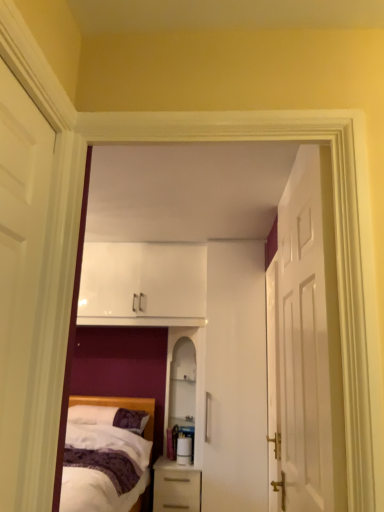
What is the approximate height of white matte door at left, positioned as the 1th door in left-to-right order?

3.34 feet.

The image size is (384, 512). What are the coordinates of `white soft bed at lower left` in the screenshot? It's located at (106, 454).

You are a GUI agent. You are given a task and a screenshot of the screen. Output one action in this format:
    pyautogui.click(x=<x>, y=<y>)
    Task: Click on the white matte door at left, which ranks as the 3th door in right-to-left order
    This screenshot has height=512, width=384.
    Given the screenshot: What is the action you would take?
    pyautogui.click(x=19, y=258)

From the picture: Considering the relative sizes of white glossy door at right, arranged as the 1th door when viewed from the right, and purple soft pillow at lower left in the image provided, is white glossy door at right, arranged as the 1th door when viewed from the right, smaller than purple soft pillow at lower left?

No, white glossy door at right, arranged as the 1th door when viewed from the right, is not smaller than purple soft pillow at lower left.

Is white glossy door at right, the 3th door when ordered from left to right, facing away from purple soft pillow at lower left?

white glossy door at right, the 3th door when ordered from left to right, does not have its back to purple soft pillow at lower left.

In the scene shown: Is white glossy door at right, the 3th door when ordered from left to right, closer to the viewer compared to purple soft pillow at lower left?

Yes, it is.

From the image's perspective, is white matte door at left, which ranks as the 3th door in right-to-left order, below white glossy door at right, arranged as the 1th door when viewed from the right?

Actually, white matte door at left, which ranks as the 3th door in right-to-left order, appears above white glossy door at right, arranged as the 1th door when viewed from the right, in the image.

Consider the image. Does white matte door at left, which ranks as the 3th door in right-to-left order, turn towards white glossy door at right, the 3th door when ordered from left to right?

No, white matte door at left, which ranks as the 3th door in right-to-left order, is not facing towards white glossy door at right, the 3th door when ordered from left to right.

In the scene shown: From a real-world perspective, between white matte door at left, which ranks as the 3th door in right-to-left order, and white glossy door at right, the 3th door when ordered from left to right, who is vertically higher?

From a 3D spatial view, white matte door at left, which ranks as the 3th door in right-to-left order, is above.

Considering the points (1, 488) and (280, 435), which point is behind, point (1, 488) or point (280, 435)?

The point (280, 435) is farther.

Between white glossy cabinet at center and white soft bed at lower left, which one appears on the left side from the viewer's perspective?

white soft bed at lower left is more to the left.

Are white glossy cabinet at center and white soft bed at lower left located far from each other?

They are positioned close to each other.

Where is `bed on the left of white glossy cabinet at center`? bed on the left of white glossy cabinet at center is located at coordinates [106, 454].

Between white matte door at left, positioned as the 1th door in left-to-right order, and white soft bed at lower left, which one has smaller width?

white matte door at left, positioned as the 1th door in left-to-right order.

Is point (38, 229) positioned before point (128, 415)?

Yes, point (38, 229) is closer to viewer.

Which of these two, white matte door at left, positioned as the 1th door in left-to-right order, or white soft bed at lower left, stands taller?

white matte door at left, positioned as the 1th door in left-to-right order.

From a real-world perspective, is white matte door at left, which ranks as the 3th door in right-to-left order, positioned over white soft bed at lower left based on gravity?

Yes.

Who is shorter, white glossy nightstand at lower center or white wooden door at right, marked as the 2th door in a right-to-left arrangement?

white glossy nightstand at lower center is shorter.

From a real-world perspective, which is physically below, white glossy nightstand at lower center or white wooden door at right, which is counted as the second door, starting from the left?

white glossy nightstand at lower center.

Is white glossy nightstand at lower center positioned with its back to white wooden door at right, which is counted as the second door, starting from the left?

No.

Is point (187, 511) closer or farther from the camera than point (306, 478)?

Clearly, point (187, 511) is more distant from the camera than point (306, 478).

Image resolution: width=384 pixels, height=512 pixels. What are the coordinates of `door beneath the white wooden door at right, marked as the 2th door in a right-to-left arrangement (from a real-world perspective)` in the screenshot? It's located at (273, 387).

Considering the relative positions of white wooden door at right, which is counted as the second door, starting from the left, and white glossy door at right, arranged as the 1th door when viewed from the right, in the image provided, is white wooden door at right, which is counted as the second door, starting from the left, to the left or to the right of white glossy door at right, arranged as the 1th door when viewed from the right,?

white wooden door at right, which is counted as the second door, starting from the left, is positioned on white glossy door at right, arranged as the 1th door when viewed from the right,'s left side.

Is white glossy door at right, the 3th door when ordered from left to right, a part of white wooden door at right, which is counted as the second door, starting from the left?

No, white glossy door at right, the 3th door when ordered from left to right, is not surrounded by white wooden door at right, which is counted as the second door, starting from the left.

Which is more to the left, white wooden door at right, which is counted as the second door, starting from the left, or white matte door at left, positioned as the 1th door in left-to-right order?

Positioned to the left is white matte door at left, positioned as the 1th door in left-to-right order.

Is white matte door at left, which ranks as the 3th door in right-to-left order, completely or partially inside white wooden door at right, marked as the 2th door in a right-to-left arrangement?

No, white wooden door at right, marked as the 2th door in a right-to-left arrangement, does not contain white matte door at left, which ranks as the 3th door in right-to-left order.

From the image's perspective, relative to white matte door at left, positioned as the 1th door in left-to-right order, is white wooden door at right, which is counted as the second door, starting from the left, above or below?

white wooden door at right, which is counted as the second door, starting from the left, is below white matte door at left, positioned as the 1th door in left-to-right order.

Which of these two, white wooden door at right, which is counted as the second door, starting from the left, or white matte door at left, positioned as the 1th door in left-to-right order, is bigger?

Bigger between the two is white wooden door at right, which is counted as the second door, starting from the left.

The image size is (384, 512). In order to click on pillow below the white glossy door at right, the 3th door when ordered from left to right (from a real-world perspective) in this screenshot , I will do `click(109, 417)`.

Image resolution: width=384 pixels, height=512 pixels. I want to click on the 2nd door above the white glossy door at right, arranged as the 1th door when viewed from the right (from the image's perspective), so click(x=19, y=258).

When comparing their distances from white glossy nightstand at lower center, does white matte door at left, positioned as the 1th door in left-to-right order, or white glossy cabinet at center seem further?

white matte door at left, positioned as the 1th door in left-to-right order.

Which object lies further to the anchor point white glossy door at right, the 3th door when ordered from left to right, white matte door at left, which ranks as the 3th door in right-to-left order, or white wooden door at right, which is counted as the second door, starting from the left?

Among the two, white matte door at left, which ranks as the 3th door in right-to-left order, is located further to white glossy door at right, the 3th door when ordered from left to right.

Which object lies further to the anchor point purple soft pillow at lower left, white soft bed at lower left or white wooden door at right, which is counted as the second door, starting from the left?

white wooden door at right, which is counted as the second door, starting from the left, is positioned further to the anchor purple soft pillow at lower left.

Based on their spatial positions, is white matte door at left, which ranks as the 3th door in right-to-left order, or white glossy cabinet at center closer to white wooden door at right, marked as the 2th door in a right-to-left arrangement?

Among the two, white matte door at left, which ranks as the 3th door in right-to-left order, is located nearer to white wooden door at right, marked as the 2th door in a right-to-left arrangement.

When comparing their distances from purple soft pillow at lower left, does white glossy cabinet at center or white wooden door at right, marked as the 2th door in a right-to-left arrangement, seem further?

white wooden door at right, marked as the 2th door in a right-to-left arrangement, is further to purple soft pillow at lower left.

Estimate the real-world distances between objects in this image. Which object is further from purple soft pillow at lower left, white soft bed at lower left or white glossy nightstand at lower center?

The object further to purple soft pillow at lower left is white glossy nightstand at lower center.

From the image, which object appears to be nearer to white glossy cabinet at center, white wooden door at right, marked as the 2th door in a right-to-left arrangement, or white glossy nightstand at lower center?

The object closer to white glossy cabinet at center is white glossy nightstand at lower center.

Estimate the real-world distances between objects in this image. Which object is further from white soft bed at lower left, white matte door at left, which ranks as the 3th door in right-to-left order, or white glossy door at right, the 3th door when ordered from left to right?

white matte door at left, which ranks as the 3th door in right-to-left order, lies further to white soft bed at lower left than the other object.

You are a GUI agent. You are given a task and a screenshot of the screen. Output one action in this format:
    pyautogui.click(x=<x>, y=<y>)
    Task: Click on the bed between white matte door at left, positioned as the 1th door in left-to-right order, and white glossy door at right, arranged as the 1th door when viewed from the right, in the front-back direction
    This screenshot has width=384, height=512.
    Given the screenshot: What is the action you would take?
    (106, 454)

The image size is (384, 512). What are the coordinates of `bed between white wooden door at right, which is counted as the second door, starting from the left, and white glossy nightstand at lower center from front to back` in the screenshot? It's located at (106, 454).

At what (x,y) coordinates should I click in order to perform the action: click on door between white wooden door at right, marked as the 2th door in a right-to-left arrangement, and purple soft pillow at lower left in the front-back direction. Please return your answer as a coordinate pair (x, y). Looking at the image, I should click on (273, 387).

Identify the location of bed between white matte door at left, positioned as the 1th door in left-to-right order, and white glossy cabinet at center in the front-back direction. (106, 454).